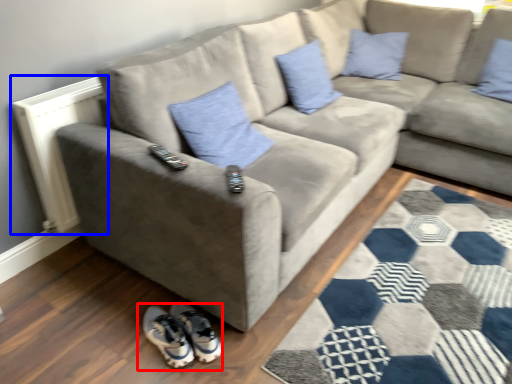
Question: Which object is closer to the camera taking this photo, footwear (highlighted by a red box) or radiator (highlighted by a blue box)?

Choices:
 (A) footwear
 (B) radiator

Answer: (A)